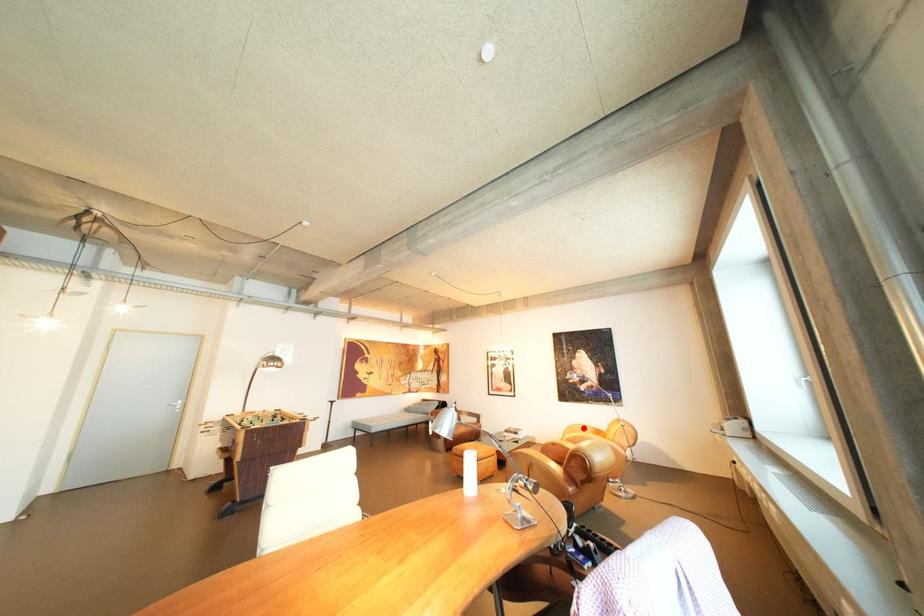
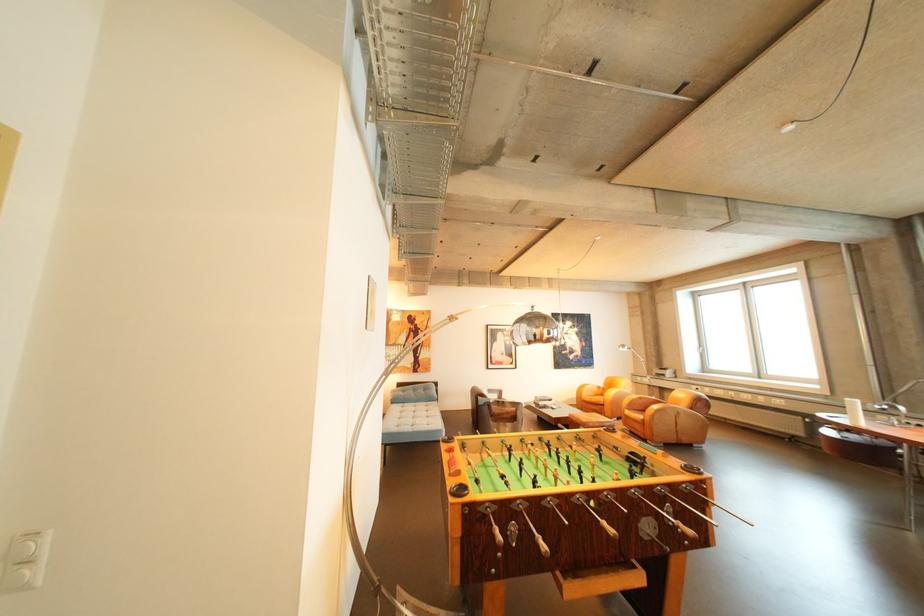
In the second image, find the point that corresponds to the highlighted location in the first image.

(594, 387)